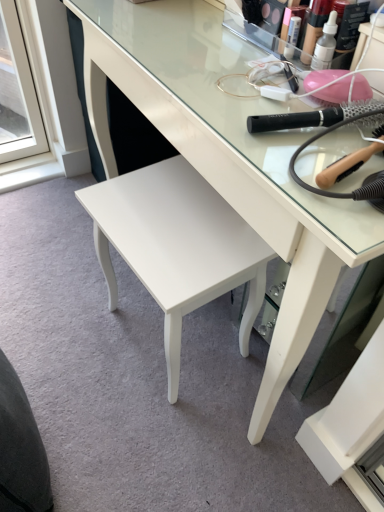
At what (x,y) coordinates should I click in order to perform the action: click on free space that is to the left of white glossy stool at center. Please return your answer as a coordinate pair (x, y). Looking at the image, I should click on (65, 319).